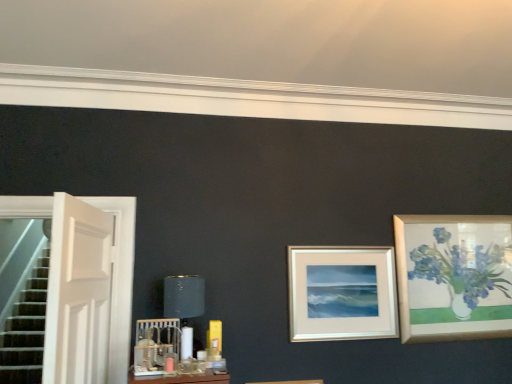
Question: From a real-world perspective, is white wooden door at left on top of matte black lampshade at center?

Choices:
 (A) yes
 (B) no

Answer: (A)

Question: Does white wooden door at left come behind matte black lampshade at center?

Choices:
 (A) no
 (B) yes

Answer: (A)

Question: Is white wooden door at left turned away from matte black lampshade at center?

Choices:
 (A) no
 (B) yes

Answer: (A)

Question: Can you confirm if white wooden door at left is thinner than matte black lampshade at center?

Choices:
 (A) yes
 (B) no

Answer: (A)

Question: Would you say matte black lampshade at center is part of white wooden door at left's contents?

Choices:
 (A) no
 (B) yes

Answer: (A)

Question: From a real-world perspective, relative to silver/metallic picture frame at center, is white wooden door at left vertically above or below?

Choices:
 (A) below
 (B) above

Answer: (B)

Question: Looking at their shapes, would you say white wooden door at left is wider or thinner than silver/metallic picture frame at center?

Choices:
 (A) thin
 (B) wide

Answer: (B)

Question: Is white wooden door at left inside the boundaries of silver/metallic picture frame at center, or outside?

Choices:
 (A) inside
 (B) outside

Answer: (B)

Question: Based on their positions, is white wooden door at left located to the left or right of silver/metallic picture frame at center?

Choices:
 (A) right
 (B) left

Answer: (B)

Question: From the image's perspective, is white wooden door at left positioned above or below matte black lampshade at center?

Choices:
 (A) above
 (B) below

Answer: (A)

Question: Which is correct: white wooden door at left is inside matte black lampshade at center, or outside of it?

Choices:
 (A) inside
 (B) outside

Answer: (B)

Question: Looking at their shapes, would you say white wooden door at left is wider or thinner than matte black lampshade at center?

Choices:
 (A) thin
 (B) wide

Answer: (A)

Question: From their relative heights in the image, would you say white wooden door at left is taller or shorter than matte black lampshade at center?

Choices:
 (A) tall
 (B) short

Answer: (A)

Question: From the image's perspective, is matte black lampshade at center positioned above or below silver/metallic picture frame at center?

Choices:
 (A) below
 (B) above

Answer: (A)

Question: Is matte black lampshade at center to the left or to the right of silver/metallic picture frame at center in the image?

Choices:
 (A) left
 (B) right

Answer: (A)